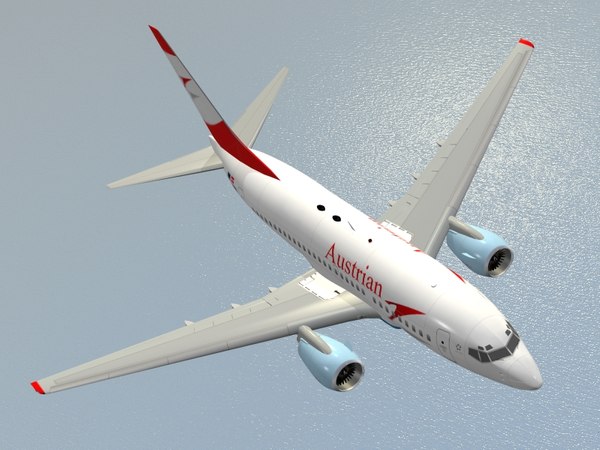
Find the location of a particular element. front windows is located at coordinates (481, 359), (473, 352), (499, 351), (516, 342), (514, 328).